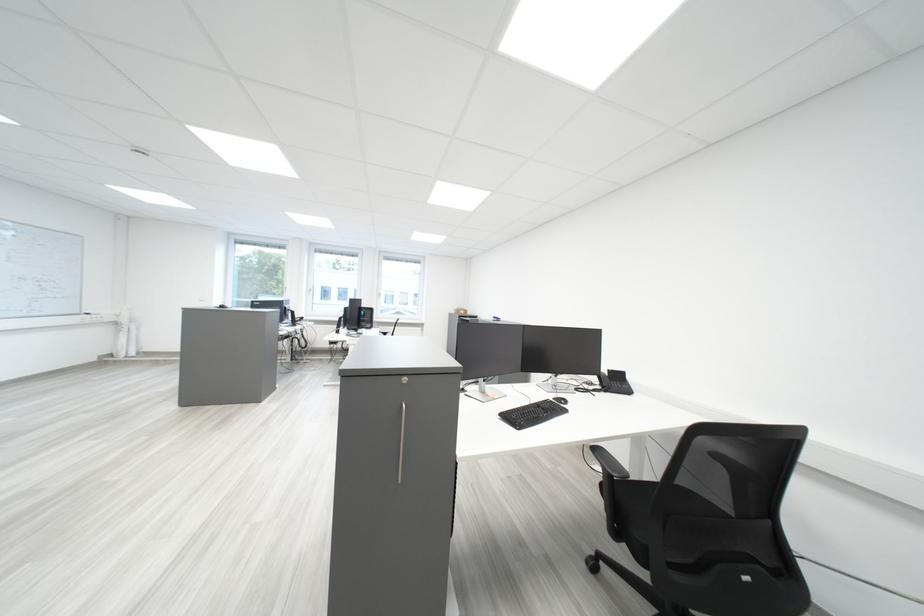
Describe the element at coordinates (532, 413) in the screenshot. The height and width of the screenshot is (616, 924). I see `a black keyboard` at that location.